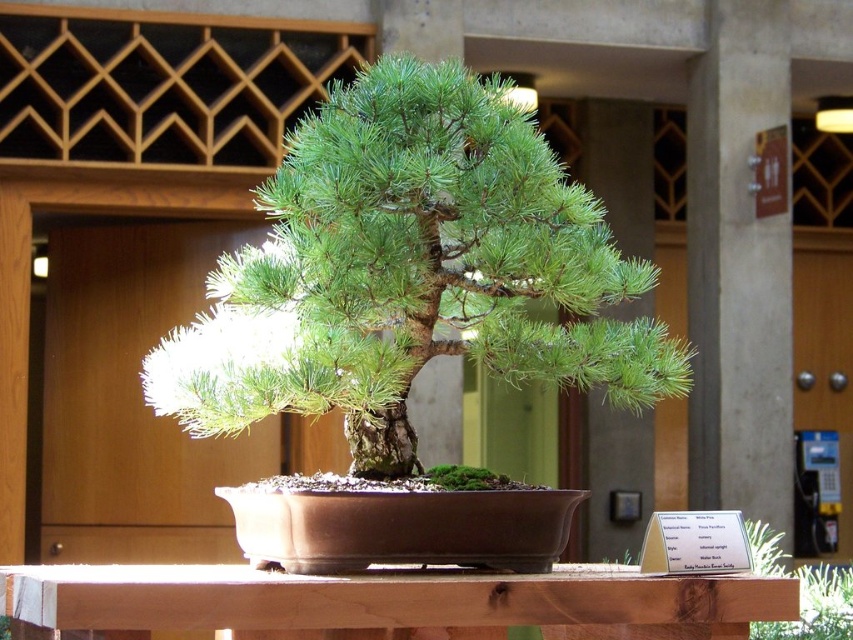
Which is above, green matte bonsai tree at center or brown wood table at center?

green matte bonsai tree at center

Can you confirm if green matte bonsai tree at center is bigger than brown wood table at center?

Correct, green matte bonsai tree at center is larger in size than brown wood table at center.

Does point (682, 374) come closer to viewer compared to point (548, 611)?

That is False.

Identify the location of green matte bonsai tree at center. The width and height of the screenshot is (853, 640). (410, 272).